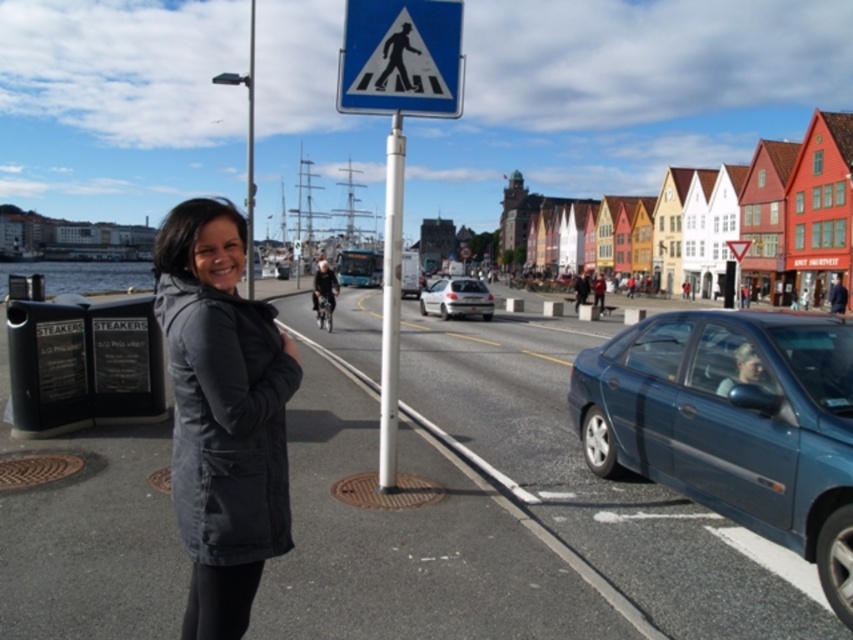
Question: Which point is closer to the camera?

Choices:
 (A) (329, 285)
 (B) (409, 65)

Answer: (B)

Question: Is matte blue sedan at center right to the right of satin silver car at center from the viewer's perspective?

Choices:
 (A) yes
 (B) no

Answer: (A)

Question: Is white smooth pole at center positioned behind dark gray jacket at center?

Choices:
 (A) yes
 (B) no

Answer: (B)

Question: Among these objects, which one is nearest to the camera?

Choices:
 (A) satin silver car at center
 (B) metallic pole at center
 (C) matte blue sedan at center right
 (D) white smooth pole at center

Answer: (C)

Question: From the image, what is the correct spatial relationship of dark gray fabric jacket at left in relation to blue plastic pedestrian crossing sign at upper center?

Choices:
 (A) left
 (B) right

Answer: (B)

Question: Which point is closer to the camera taking this photo?

Choices:
 (A) (437, 76)
 (B) (804, 339)

Answer: (B)